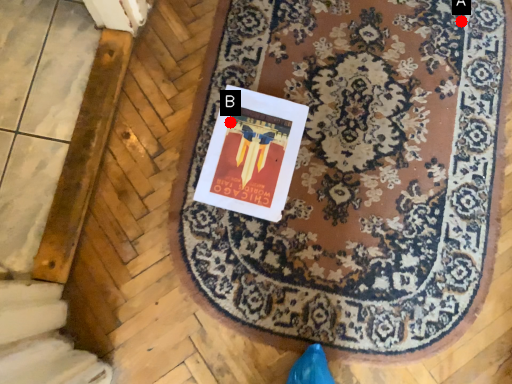
Question: Two points are circled on the image, labeled by A and B beside each circle. Among these points, which one is farthest from the camera?

Choices:
 (A) A is further
 (B) B is further

Answer: (A)